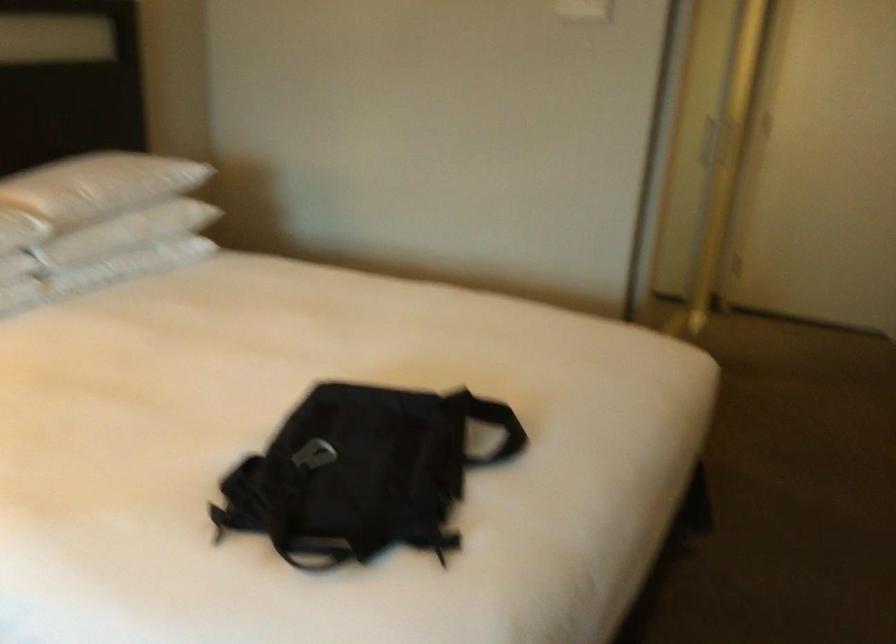
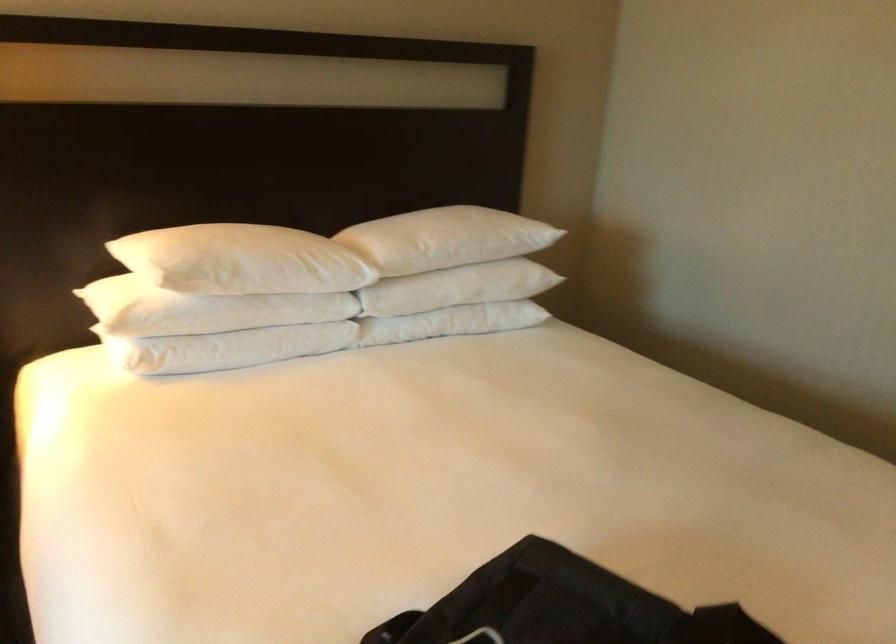
Where in the second image is the point corresponding to pixel 321 451 from the first image?

(480, 637)